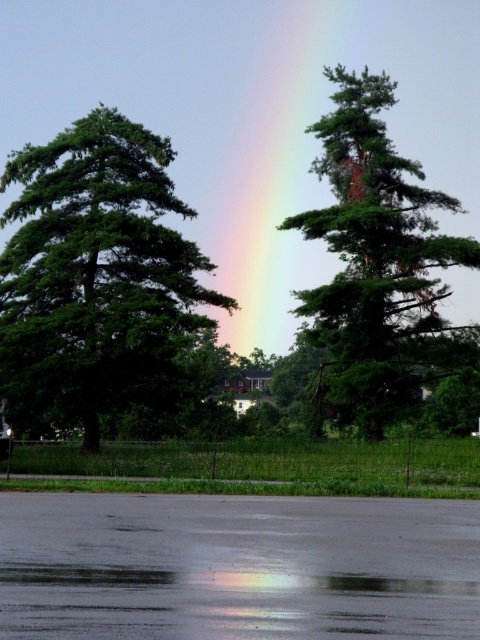
You are standing in the parking lot and want to take a photo of the rainbow at center. However, you notice the green matte tree at center might block your view. Based on their positions, will the tree obscure the rainbow in your photo?

The green matte tree at center is closer to the viewer than the rainbow at center, so the tree will partially or fully block the rainbow in your photo.

You are standing in the parking lot and see the green leafy tree at left and the green matte tree at center. Which tree is closer to the ground?

The green leafy tree at left is closer to the ground because it is positioned below the green matte tree at center.